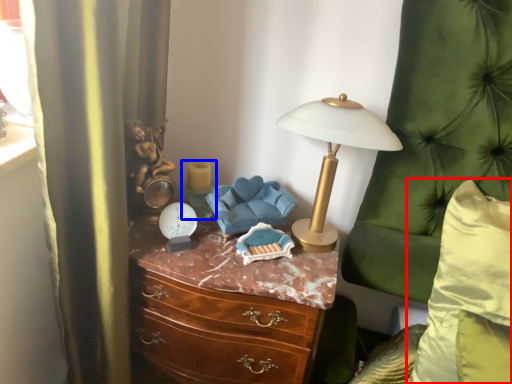
Question: Which point is closer to the camera, pillow (highlighted by a red box) or candle holder (highlighted by a blue box)?

Choices:
 (A) pillow
 (B) candle holder

Answer: (A)